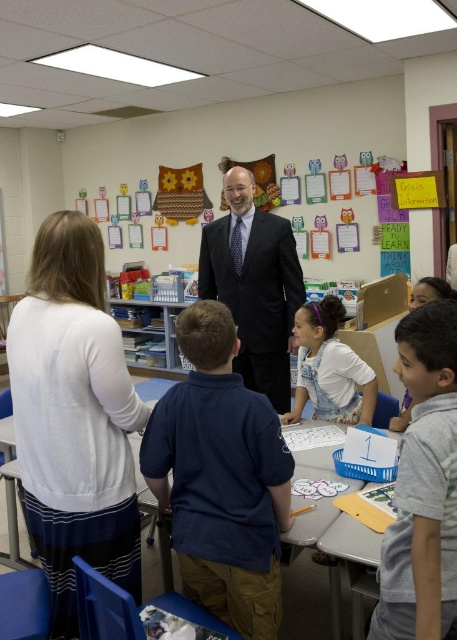
Is white sweater at left in front of gray cotton shirt at lower right?

No.

Describe the element at coordinates (74, 417) in the screenshot. This screenshot has width=457, height=640. I see `white sweater at left` at that location.

Identify the location of white sweater at left. Image resolution: width=457 pixels, height=640 pixels. click(74, 417).

Does gray cotton shirt at lower right have a lesser height compared to white cotton shirt at center?

No, gray cotton shirt at lower right is not shorter than white cotton shirt at center.

Which is more to the left, gray cotton shirt at lower right or white cotton shirt at center?

gray cotton shirt at lower right is more to the left.

Which is in front, point (441, 424) or point (340, 307)?

Positioned in front is point (441, 424).

Identify the location of gray cotton shirt at lower right. This screenshot has width=457, height=640. (423, 486).

Does dark blue shirt at center have a greater width compared to white cotton shirt at center?

Yes, dark blue shirt at center is wider than white cotton shirt at center.

Is dark blue shirt at center positioned behind white cotton shirt at center?

No, it is not.

Is point (190, 476) positioned behind point (355, 404)?

No, (190, 476) is closer to viewer.

Identify the location of dark blue shirt at center. (221, 477).